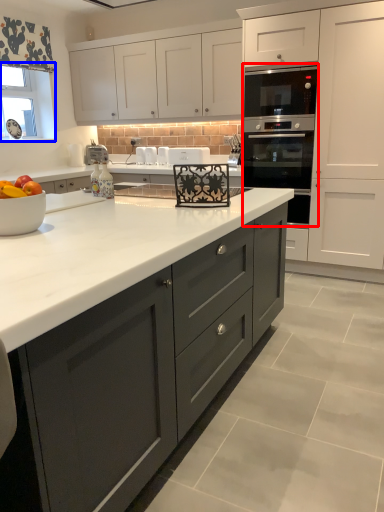
Question: Which point is further to the camera, oven (highlighted by a red box) or window screen (highlighted by a blue box)?

Choices:
 (A) oven
 (B) window screen

Answer: (B)